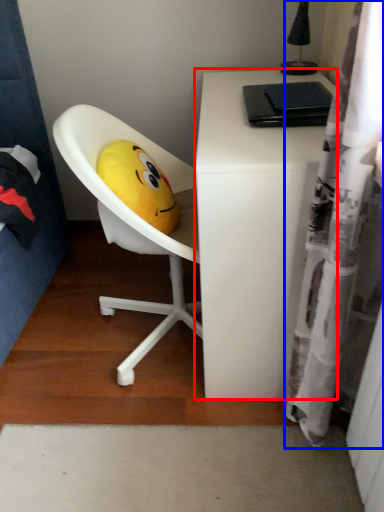
Question: Among these objects, which one is farthest to the camera, desk (highlighted by a red box) or shower curtain (highlighted by a blue box)?

Choices:
 (A) desk
 (B) shower curtain

Answer: (A)